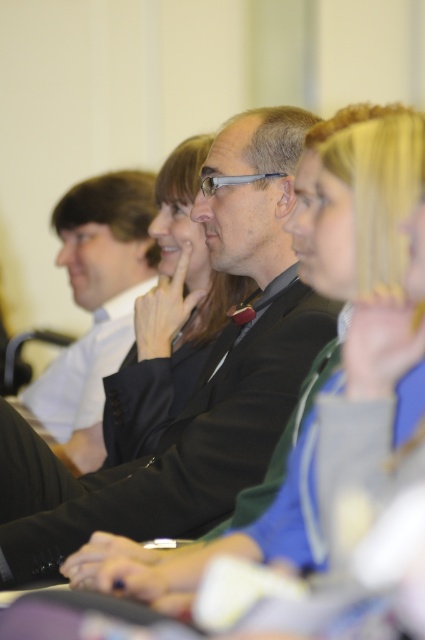
Find the location of a particular element. The image size is (425, 640). matte black suit at center is located at coordinates (96, 305).

Can you confirm if matte black suit at center is bigger than smooth black jacket at center?

Yes.

Who is more forward, (110,332) or (152,426)?

Point (152,426) is more forward.

This screenshot has width=425, height=640. Identify the location of matte black suit at center. (96, 305).

Is black matte suit at center closer to camera compared to smooth black jacket at center?

That is True.

Does point (178, 426) come closer to viewer compared to point (130, 435)?

Yes, it is in front of point (130, 435).

What are the coordinates of `black matte suit at center` in the screenshot? It's located at (200, 378).

Can you confirm if black matte suit at center is positioned to the left of matte black suit at center?

In fact, black matte suit at center is to the right of matte black suit at center.

Which is behind, point (8, 502) or point (68, 442)?

Point (68, 442)

Identify the location of black matte suit at center. The image size is (425, 640). (200, 378).